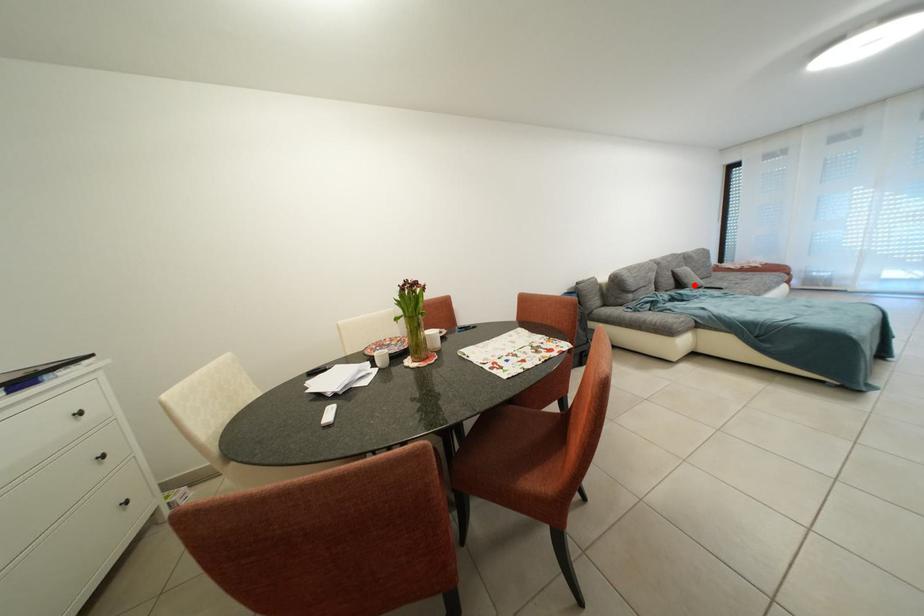
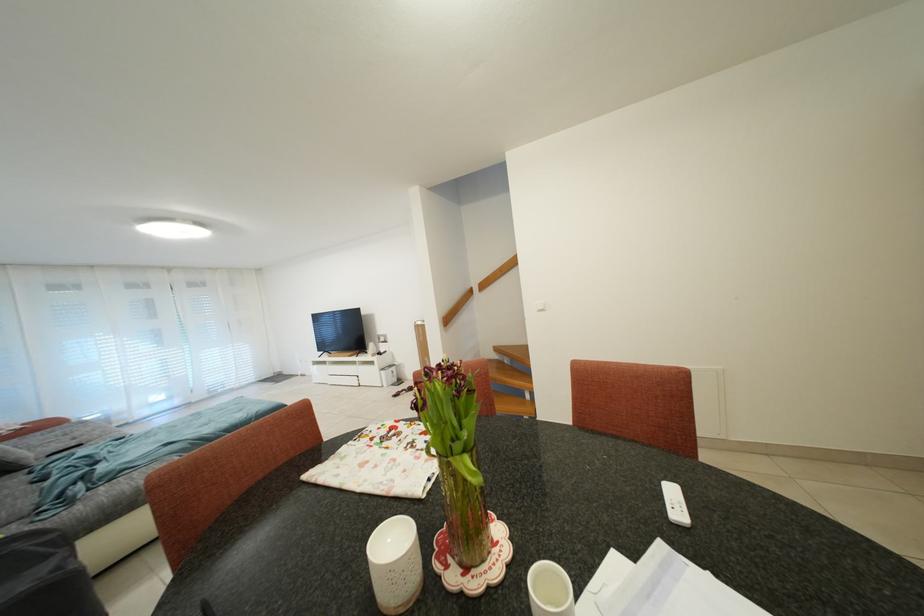
Question: I am providing you with two images of the same scene from different viewpoints. In image1, a red point is highlighted. Considering the same 3D point in image2, which of the following is correct?

Choices:
 (A) It is closer
 (B) It is farther

Answer: (B)